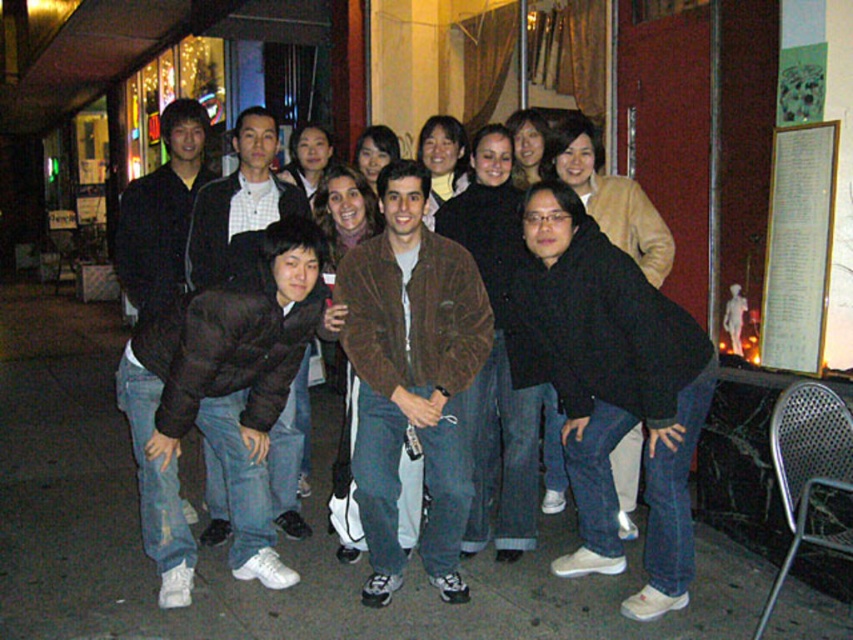
Measure the distance from dark brown puffy jacket at lower left to brown fuzzy jacket at center.

23.40 inches

Who is positioned more to the right, dark brown puffy jacket at lower left or brown fuzzy jacket at center?

dark brown puffy jacket at lower left

Measure the distance between point [170,486] and camera.

Point [170,486] is 3.68 meters away from camera.

The width and height of the screenshot is (853, 640). What are the coordinates of `dark brown puffy jacket at lower left` in the screenshot? It's located at (219, 404).

Can you confirm if brown suede jacket at center is positioned below brown fuzzy jacket at center?

Yes.

Can you confirm if brown suede jacket at center is taller than brown fuzzy jacket at center?

Correct, brown suede jacket at center is much taller as brown fuzzy jacket at center.

You are a GUI agent. You are given a task and a screenshot of the screen. Output one action in this format:
    pyautogui.click(x=<x>, y=<y>)
    Task: Click on the brown suede jacket at center
    
    Given the screenshot: What is the action you would take?
    pyautogui.click(x=410, y=378)

Find the location of a particular element. brown suede jacket at center is located at coordinates (410, 378).

How much distance is there between brown suede jacket at center and dark brown puffy jacket at lower left?

22.08 inches

Which is in front, point (438, 397) or point (279, 291)?

Point (438, 397) is more forward.

Describe the element at coordinates (410, 378) in the screenshot. The image size is (853, 640). I see `brown suede jacket at center` at that location.

Identify the location of brown suede jacket at center. This screenshot has height=640, width=853. (410, 378).